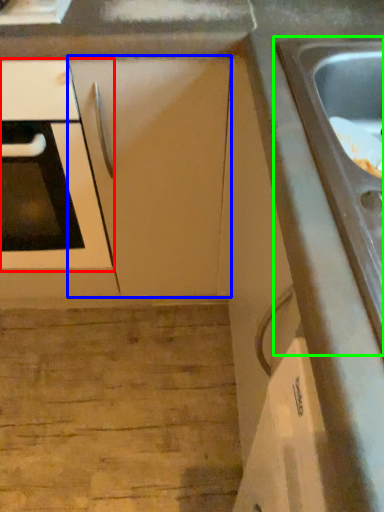
Question: Which is nearer to the oven (highlighted by a red box)? cabinetry (highlighted by a blue box) or sink (highlighted by a green box).

Choices:
 (A) cabinetry
 (B) sink

Answer: (A)